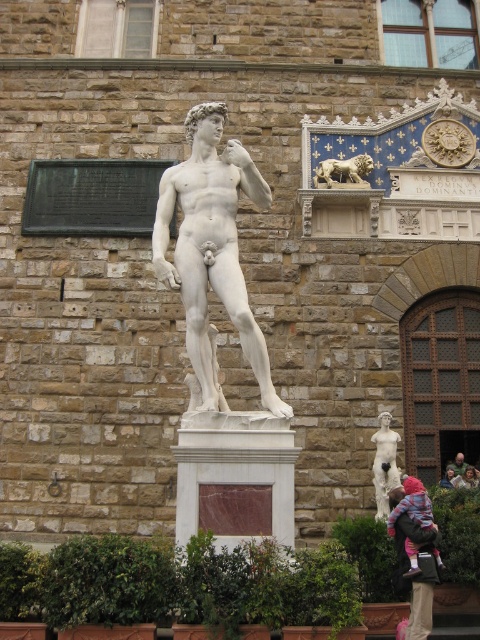
Based on the photo, you are standing 100 feet away from the classical marble statue of David. You want to move closer to the statue to take a photo. If you walk straight towards the statue until you reach the point at coordinates point (237, 148), how much closer will you be to the statue?

The distance of point (237, 148) from viewer is 108.36 feet. Since you are currently 100 feet away, moving to that point would actually put you 8.36 feet farther away from the statue.

You are an art student who wants to sketch the statue of David. You notice the light brown wood chair at lower right and the brown hair at lower right. Which object is closer to the statue?

The light brown wood chair at lower right is smaller than the brown hair at lower right, so the chair is closer to the statue than the hair.

You are an art student analyzing the composition of the scene. Based on the placement of the white marble statue at center and the brown hair at lower right, which object is located to the right of the other?

The white marble statue at center is positioned on the left side of brown hair at lower right, meaning the brown hair at lower right is to the right of the white marble statue at center.